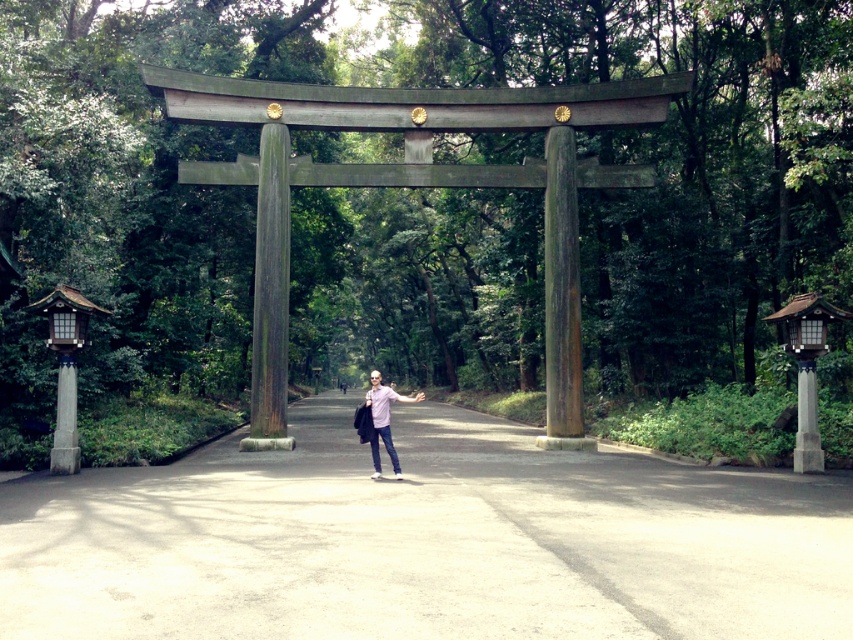
You are a visitor standing at the entrance of the shrine. You notice the smooth concrete path at center and the weathered wood pillar at center. Which object is taller from your viewpoint?

The weathered wood pillar at center is taller than the smooth concrete path at center.

You are standing at the entrance of a Shinto shrine and see the torii gate ahead. There is a point marked at coordinates (561, 296). What object is located at this point?

The point at coordinates (561, 296) indicates the rusty wood pillar at center.